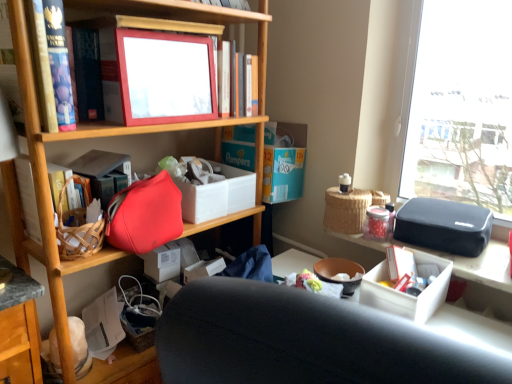
Measure the distance between point (242,91) and camera.

A distance of 1.43 meters exists between point (242,91) and camera.

What do you see at coordinates (237, 83) in the screenshot?
I see `matte plastic picture frame at upper center, marked as the 1th book in a right-to-left arrangement` at bounding box center [237, 83].

Identify the location of woven picnic basket at upper right. This screenshot has width=512, height=384. (350, 208).

This screenshot has width=512, height=384. What do you see at coordinates (165, 77) in the screenshot? I see `matte plastic picture frame at upper center` at bounding box center [165, 77].

The image size is (512, 384). What are the coordinates of `matte red book at left, the first book when ordered from left to right` in the screenshot? It's located at (103, 173).

You are a GUI agent. You are given a task and a screenshot of the screen. Output one action in this format:
    pyautogui.click(x=<x>, y=<y>)
    Task: Click on the matte red handbag at center-left
    
    Given the screenshot: What is the action you would take?
    pyautogui.click(x=145, y=215)

Measure the distance between matte red handbag at center-left and camera.

matte red handbag at center-left and camera are 1.13 meters apart from each other.

Where is `matte plastic picture frame at upper center, placed as the first book when sorted from top to bottom`? This screenshot has width=512, height=384. matte plastic picture frame at upper center, placed as the first book when sorted from top to bottom is located at coordinates (237, 83).

Can you tell me how much woven picnic basket at upper right and matte red book at left, marked as the first book in a bottom-to-top arrangement, differ in facing direction?

The angular difference between woven picnic basket at upper right and matte red book at left, marked as the first book in a bottom-to-top arrangement, is 91.8 degrees.

Measure the distance from woven picnic basket at upper right to matte red book at left, the first book when ordered from left to right.

woven picnic basket at upper right is 73.77 centimeters away from matte red book at left, the first book when ordered from left to right.

Which is more to the right, woven picnic basket at upper right or matte red book at left, marked as the first book in a bottom-to-top arrangement?

woven picnic basket at upper right is more to the right.

Which is nearer, (x=333, y=202) or (x=125, y=178)?

Clearly, point (x=333, y=202) is more distant from the camera than point (x=125, y=178).

Does matte red book at left, which is the second book from top to bottom, have a greater height compared to matte plastic picture frame at upper center?

No, matte red book at left, which is the second book from top to bottom, is not taller than matte plastic picture frame at upper center.

From a real-world perspective, who is located higher, matte red book at left, which is the second book from top to bottom, or matte plastic picture frame at upper center?

matte plastic picture frame at upper center is physically above.

The height and width of the screenshot is (384, 512). In order to click on the 1st book behind the matte plastic picture frame at upper center, counting from the anchor's position in this screenshot , I will do `click(103, 173)`.

Consider the image. Which object is positioned more to the right, matte plastic picture frame at upper center or matte plastic picture frame at upper center, which is the second book from left to right?

matte plastic picture frame at upper center, which is the second book from left to right, is more to the right.

Would you say matte plastic picture frame at upper center is outside matte plastic picture frame at upper center, marked as the 1th book in a right-to-left arrangement?

Absolutely, matte plastic picture frame at upper center is external to matte plastic picture frame at upper center, marked as the 1th book in a right-to-left arrangement.

Which of these two, white cardboard box at center or matte plastic picture frame at upper center, stands taller?

With more height is matte plastic picture frame at upper center.

Consider the image. What's the angular difference between white cardboard box at center and matte plastic picture frame at upper center's facing directions?

The angular difference between white cardboard box at center and matte plastic picture frame at upper center is 2.14 degrees.

Is white cardboard box at center touching matte plastic picture frame at upper center?

No, white cardboard box at center is not beside matte plastic picture frame at upper center.

Is white cardboard box at center at the left side of matte plastic picture frame at upper center?

In fact, white cardboard box at center is to the right of matte plastic picture frame at upper center.

Considering the positions of point (133, 194) and point (201, 106), is point (133, 194) closer or farther from the camera than point (201, 106)?

Clearly, point (133, 194) is closer to the camera than point (201, 106).

Is matte red handbag at center-left not within matte plastic picture frame at upper center?

That's correct, matte red handbag at center-left is outside of matte plastic picture frame at upper center.

Between matte red handbag at center-left and matte plastic picture frame at upper center, which one has more height?

matte plastic picture frame at upper center is taller.

Considering the positions of objects matte red book at left, arranged as the 2th book when viewed from the right, and white cardboard box at center in the image provided, who is behind, matte red book at left, arranged as the 2th book when viewed from the right, or white cardboard box at center?

white cardboard box at center.

Does point (122, 157) lie behind point (206, 211)?

No, (122, 157) is in front of (206, 211).

Can white cardboard box at center be found inside matte red book at left, which is the second book from top to bottom?

Definitely not — white cardboard box at center is not inside matte red book at left, which is the second book from top to bottom.

Does matte red book at left, arranged as the 2th book when viewed from the right, appear on the left side of white cardboard box at center?

Yes.

Considering the points (159, 70) and (169, 182), which point is in front, point (159, 70) or point (169, 182)?

Point (159, 70)

Who is bigger, matte plastic picture frame at upper center or matte red handbag at center-left?

Bigger between the two is matte red handbag at center-left.

Is matte red handbag at center-left at the back of matte plastic picture frame at upper center?

No, matte plastic picture frame at upper center is not facing away from matte red handbag at center-left.

Identify the location of picnic basket that is below the matte red book at left, the first book when ordered from left to right (from the image's perspective). (350, 208).

Find the location of a particular element. the 2nd book positioned below the matte plastic picture frame at upper center (from a real-world perspective) is located at coordinates (103, 173).

Looking at this image, from the image, which object appears to be farther from woven picnic basket at upper right, matte red handbag at center-left or matte red book at left, the first book when ordered from left to right?

matte red book at left, the first book when ordered from left to right, lies further to woven picnic basket at upper right than the other object.

Considering their positions, is matte plastic picture frame at upper center positioned closer to matte red handbag at center-left than matte red book at left, the first book when ordered from left to right?

Based on the image, matte red book at left, the first book when ordered from left to right, appears to be nearer to matte red handbag at center-left.

Estimate the real-world distances between objects in this image. Which object is closer to matte plastic picture frame at upper center, which is the second book from left to right, white cardboard box at center or matte red handbag at center-left?

white cardboard box at center is positioned closer to the anchor matte plastic picture frame at upper center, which is the second book from left to right.

Which object lies nearer to the anchor point matte red book at left, which is the second book from top to bottom, white cardboard box at center or matte red handbag at center-left?

Among the two, matte red handbag at center-left is located nearer to matte red book at left, which is the second book from top to bottom.

Looking at the image, which one is located further to matte red handbag at center-left, white cardboard box at center or woven picnic basket at upper right?

The object further to matte red handbag at center-left is woven picnic basket at upper right.

Looking at the image, which one is located closer to matte plastic picture frame at upper center, matte plastic picture frame at upper center, placed as the first book when sorted from top to bottom, or white cardboard box at center?

Based on the image, matte plastic picture frame at upper center, placed as the first book when sorted from top to bottom, appears to be nearer to matte plastic picture frame at upper center.

Based on their spatial positions, is matte plastic picture frame at upper center or white cardboard box at center closer to matte plastic picture frame at upper center, which is the second book from left to right?

The object closer to matte plastic picture frame at upper center, which is the second book from left to right, is matte plastic picture frame at upper center.

From the image, which object appears to be nearer to white cardboard box at center, woven picnic basket at upper right or matte red book at left, the first book when ordered from left to right?

The object closer to white cardboard box at center is matte red book at left, the first book when ordered from left to right.

This screenshot has height=384, width=512. I want to click on book that lies between matte plastic picture frame at upper center, positioned as the second book in bottom-to-top order, and matte red handbag at center-left from top to bottom, so click(x=103, y=173).

Find the location of a particular element. book between matte plastic picture frame at upper center and white cardboard box at center in the up-down direction is located at coordinates (103, 173).

Find the location of `storage box between matte red handbag at center-left and woven picnic basket at upper right`. storage box between matte red handbag at center-left and woven picnic basket at upper right is located at coordinates (210, 188).

Where is `picture frame that lies between matte plastic picture frame at upper center, which is the second book from left to right, and white cardboard box at center from top to bottom`? The width and height of the screenshot is (512, 384). picture frame that lies between matte plastic picture frame at upper center, which is the second book from left to right, and white cardboard box at center from top to bottom is located at coordinates pos(165,77).